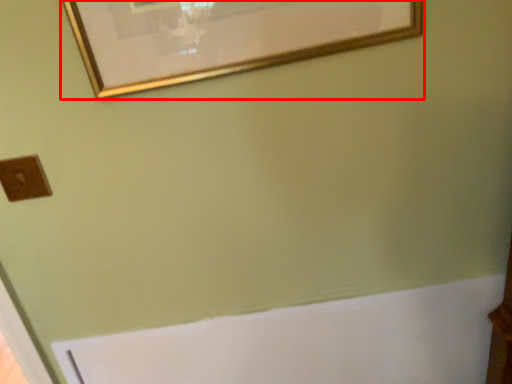
Question: Where is picture frame (annotated by the red box) located in relation to light switch in the image?

Choices:
 (A) left
 (B) right

Answer: (B)